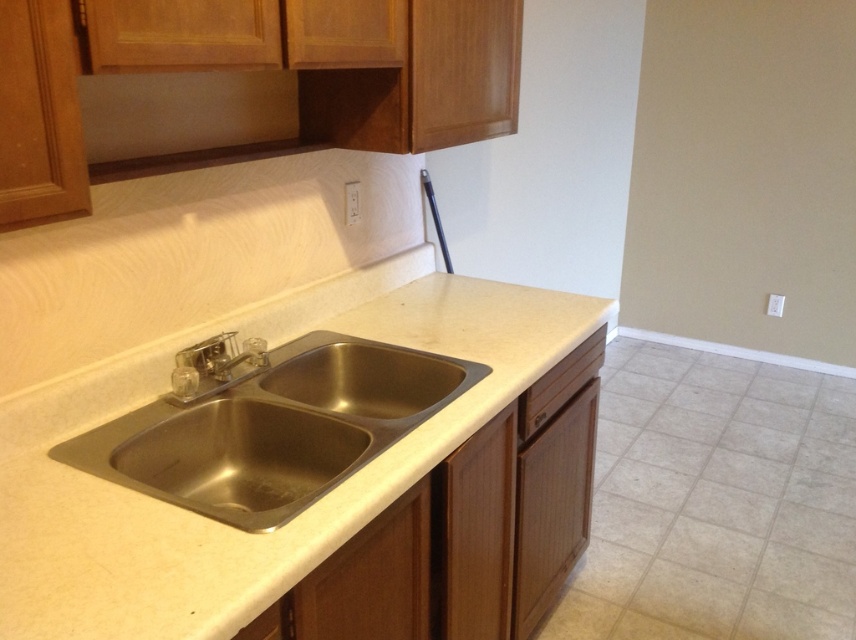
Does point (239, 420) come closer to viewer compared to point (188, 368)?

No.

Is point (214, 461) positioned after point (177, 371)?

Yes, point (214, 461) is farther from viewer.

This screenshot has width=856, height=640. Describe the element at coordinates (272, 428) in the screenshot. I see `stainless steel sink at center` at that location.

Locate an element on the screen. stainless steel sink at center is located at coordinates (272, 428).

Does matte brown exhaust hood at upper center have a lesser height compared to satin nickel faucet at center?

In fact, matte brown exhaust hood at upper center may be taller than satin nickel faucet at center.

Is point (120, 74) behind point (212, 390)?

No, (120, 74) is in front of (212, 390).

At what (x,y) coordinates should I click in order to perform the action: click on matte brown exhaust hood at upper center. Please return your answer as a coordinate pair (x, y). Image resolution: width=856 pixels, height=640 pixels. Looking at the image, I should click on (183, 115).

What are the coordinates of `matte brown exhaust hood at upper center` in the screenshot? It's located at (183, 115).

Does beige laminate countertop at center have a greater height compared to satin nickel faucet at center?

Indeed, beige laminate countertop at center has a greater height compared to satin nickel faucet at center.

Consider the image. Does beige laminate countertop at center appear on the right side of satin nickel faucet at center?

Indeed, beige laminate countertop at center is positioned on the right side of satin nickel faucet at center.

At what (x,y) coordinates should I click in order to perform the action: click on beige laminate countertop at center. Please return your answer as a coordinate pair (x, y). Looking at the image, I should click on (221, 524).